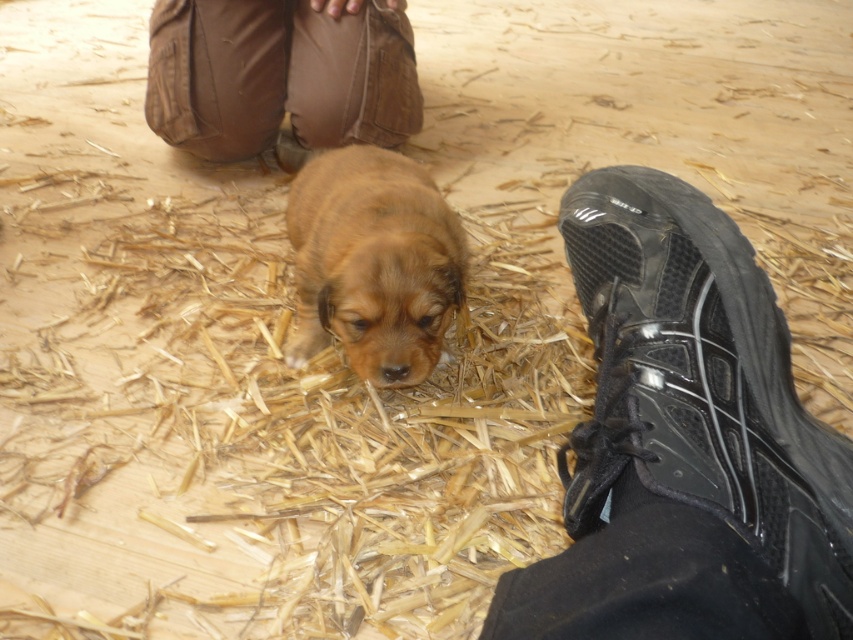
You are a photographer trying to capture a closeup of the brown furry puppy at center. However, the black rubber shoe at lower right is blocking the view. Can you determine which side of the puppy the shoe is on?

The black rubber shoe at lower right is positioned on the right side of brown furry puppy at center, so it is blocking the right side of the puppy.